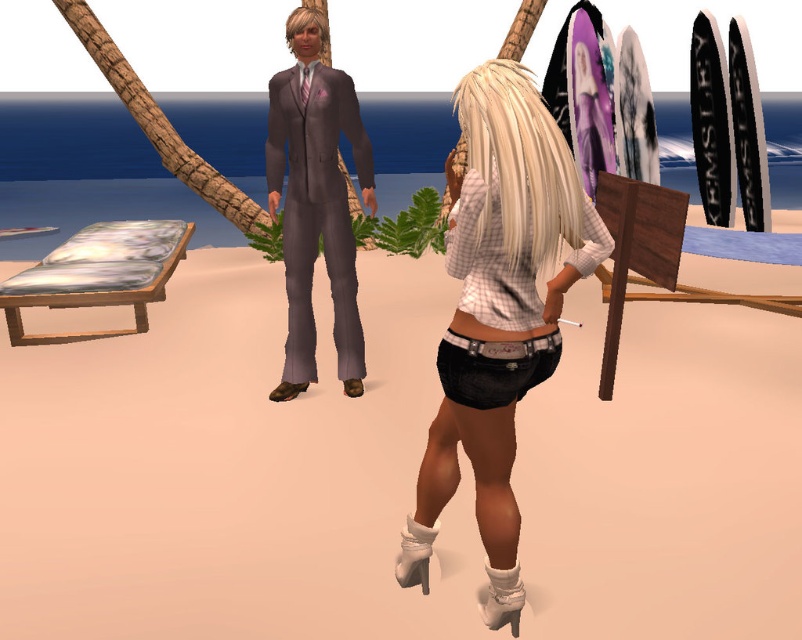
Between beige sand at center and matte gray suit at center, which one is positioned higher?

matte gray suit at center is above.

The height and width of the screenshot is (640, 802). What do you see at coordinates (229, 468) in the screenshot? I see `beige sand at center` at bounding box center [229, 468].

You are a GUI agent. You are given a task and a screenshot of the screen. Output one action in this format:
    pyautogui.click(x=<x>, y=<y>)
    Task: Click on the beige sand at center
    This screenshot has height=640, width=802.
    Given the screenshot: What is the action you would take?
    pyautogui.click(x=229, y=468)

At what (x,y) coordinates should I click in order to perform the action: click on beige sand at center. Please return your answer as a coordinate pair (x, y). Image resolution: width=802 pixels, height=640 pixels. Looking at the image, I should click on (229, 468).

Between point (424, 588) and point (310, 24), which one is positioned in front?

Point (424, 588)

Does denim shorts at center appear on the left side of matte gray suit at center?

In fact, denim shorts at center is to the right of matte gray suit at center.

Where is `denim shorts at center`? Image resolution: width=802 pixels, height=640 pixels. denim shorts at center is located at coordinates (497, 314).

Does beige sand at center have a greater height compared to denim shorts at center?

No, beige sand at center is not taller than denim shorts at center.

Who is positioned more to the left, beige sand at center or denim shorts at center?

From the viewer's perspective, beige sand at center appears more on the left side.

At what (x,y) coordinates should I click in order to perform the action: click on beige sand at center. Please return your answer as a coordinate pair (x, y). The image size is (802, 640). Looking at the image, I should click on (229, 468).